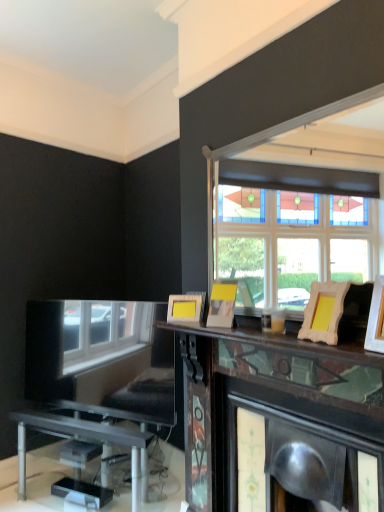
Question: Is wooden picture frame at upper right, which ranks as the second picture frame in right-to-left order, positioned behind yellow matte picture frame at center, acting as the 4th picture frame starting from the front?

Choices:
 (A) yes
 (B) no

Answer: (B)

Question: From a real-world perspective, is wooden picture frame at upper right, arranged as the 2th picture frame when viewed from the front, physically above yellow matte picture frame at center, acting as the 4th picture frame starting from the front?

Choices:
 (A) no
 (B) yes

Answer: (B)

Question: Is wooden picture frame at upper right, which ranks as the second picture frame in right-to-left order, thinner than yellow matte picture frame at center, the 4th picture frame from the right?

Choices:
 (A) no
 (B) yes

Answer: (A)

Question: Is wooden picture frame at upper right, acting as the third picture frame starting from the left, positioned with its back to yellow matte picture frame at center, acting as the 4th picture frame starting from the front?

Choices:
 (A) no
 (B) yes

Answer: (A)

Question: From the image's perspective, is wooden picture frame at upper right, which ranks as the second picture frame in right-to-left order, beneath yellow matte picture frame at center, which is the 1th picture frame in left-to-right order?

Choices:
 (A) no
 (B) yes

Answer: (A)

Question: Is wooden picture frame at upper right, which is counted as the 3th picture frame, starting from the back, wider than yellow matte picture frame at center, which is the 1th picture frame in left-to-right order?

Choices:
 (A) yes
 (B) no

Answer: (A)

Question: Does yellow matte picture frame at upper center, the third picture frame viewed from the front, touch yellow matte picture frame at center, the 4th picture frame from the right?

Choices:
 (A) yes
 (B) no

Answer: (B)

Question: Does yellow matte picture frame at upper center, which appears as the second picture frame when viewed from the back, lie behind yellow matte picture frame at center, acting as the 4th picture frame starting from the front?

Choices:
 (A) no
 (B) yes

Answer: (A)

Question: Is yellow matte picture frame at upper center, the third picture frame viewed from the front, outside yellow matte picture frame at center, acting as the 4th picture frame starting from the front?

Choices:
 (A) no
 (B) yes

Answer: (B)

Question: Can you confirm if yellow matte picture frame at upper center, which appears as the second picture frame when viewed from the back, is bigger than yellow matte picture frame at center, the first picture frame viewed from the back?

Choices:
 (A) yes
 (B) no

Answer: (A)

Question: Is yellow matte picture frame at upper center, the 3th picture frame positioned from the right, looking in the opposite direction of yellow matte picture frame at center, acting as the 4th picture frame starting from the front?

Choices:
 (A) yes
 (B) no

Answer: (B)

Question: Can you confirm if yellow matte picture frame at upper center, which appears as the second picture frame when viewed from the back, is wider than yellow matte picture frame at center, acting as the 4th picture frame starting from the front?

Choices:
 (A) yes
 (B) no

Answer: (A)

Question: From the image's perspective, is wooden picture frame at upper right, acting as the third picture frame starting from the left, above yellow matte picture frame at upper center, the 3th picture frame positioned from the right?

Choices:
 (A) no
 (B) yes

Answer: (B)